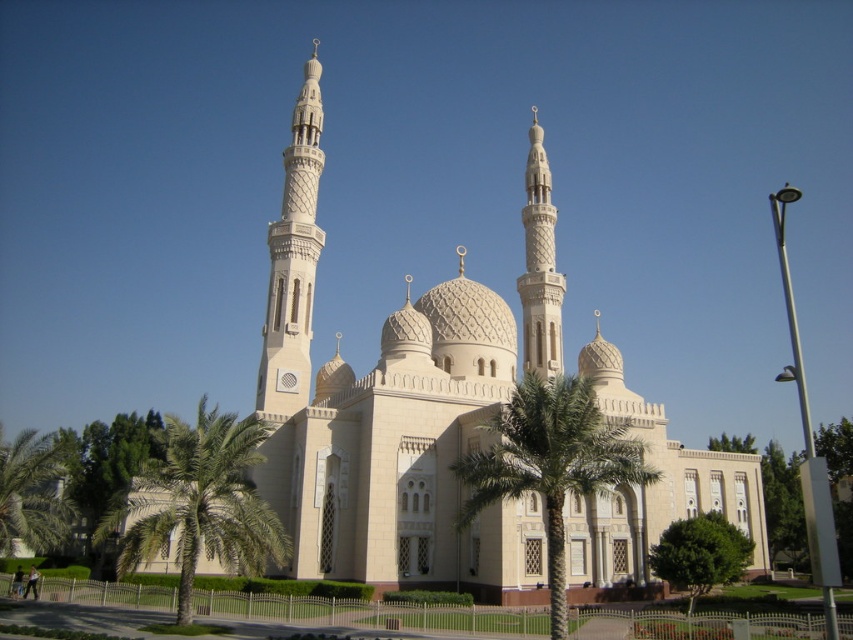
You are standing in front of the mosque and want to take a photo that includes both the green leafy palm tree at center and the white stone minaret at center. Based on their positions, which object should appear lower in the photo?

The green leafy palm tree at center should appear lower in the photo because it is located below the white stone minaret at center.

You are standing in front of the grand mosque and want to take a photo that includes both the green leafy palm tree at center and the white stone minaret at center. Which object should you position closer to the foreground to ensure both are fully visible in the frame?

You should position the green leafy palm tree at center closer to the foreground because it is shorter than the white stone minaret at center, allowing both to be fully visible in the frame.